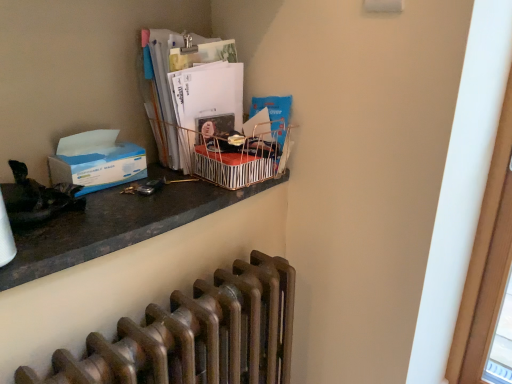
Question: Does point (104, 158) appear closer or farther from the camera than point (163, 135)?

Choices:
 (A) closer
 (B) farther

Answer: (A)

Question: Based on their sizes in the image, would you say blue paper at left is bigger or smaller than matte paper magazine at upper center?

Choices:
 (A) small
 (B) big

Answer: (A)

Question: Estimate the real-world distances between objects in this image. Which object is closer to the metallic striped basket at upper center?

Choices:
 (A) bronze metallic radiator at lower center
 (B) matte black desk at upper left
 (C) matte paper magazine at upper center
 (D) blue paper at left

Answer: (C)

Question: Which object is positioned closest to the matte paper magazine at upper center?

Choices:
 (A) matte black desk at upper left
 (B) blue paper at left
 (C) metallic striped basket at upper center
 (D) bronze metallic radiator at lower center

Answer: (C)